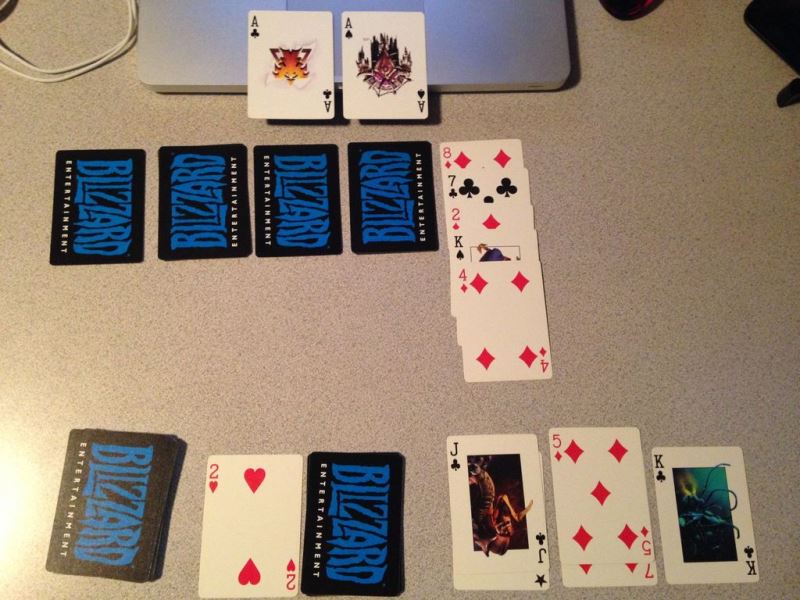
The image size is (800, 600). In order to click on cords in this screenshot , I will do coord(85,60), coord(88,68).